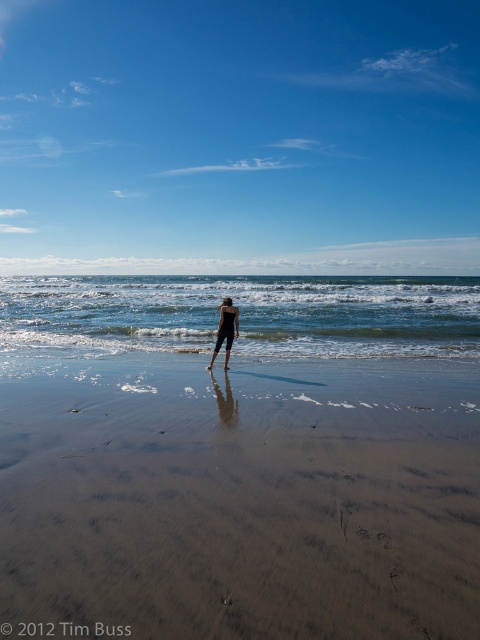
Question: Does sandy brown at lower center have a larger size compared to blue water at lower center?

Choices:
 (A) no
 (B) yes

Answer: (A)

Question: Which of the following is the farthest from the observer?

Choices:
 (A) (204, 545)
 (B) (330, 285)
 (C) (219, 330)

Answer: (B)

Question: Which of the following is the farthest from the observer?

Choices:
 (A) (355, 518)
 (B) (156, 296)
 (C) (228, 305)

Answer: (B)

Question: Which point is closer to the camera taking this photo?

Choices:
 (A) (233, 465)
 (B) (226, 360)
 (C) (376, 337)

Answer: (A)

Question: Where is blue water at lower center located in relation to black matte swimsuit at center in the image?

Choices:
 (A) above
 (B) below

Answer: (A)

Question: Can you confirm if blue water at lower center is positioned above black matte swimsuit at center?

Choices:
 (A) yes
 (B) no

Answer: (A)